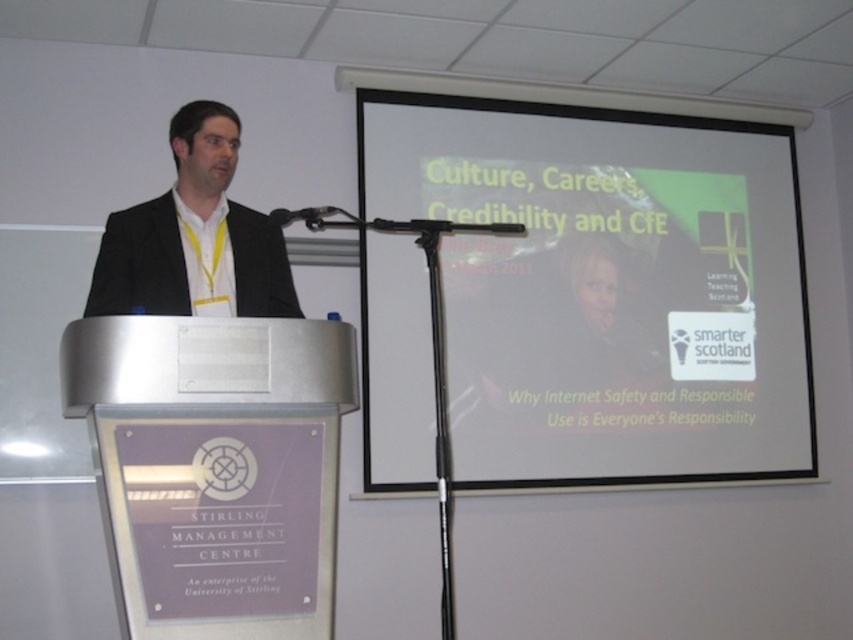
Is white matte projection screen at upper right shorter than black metallic microphone at center?

Incorrect, white matte projection screen at upper right's height does not fall short of black metallic microphone at center's.

Does white matte projection screen at upper right appear on the left side of black metallic microphone at center?

No, white matte projection screen at upper right is not to the left of black metallic microphone at center.

Measure the distance between white matte projection screen at upper right and camera.

They are 3.17 meters apart.

At what (x,y) coordinates should I click in order to perform the action: click on white matte projection screen at upper right. Please return your answer as a coordinate pair (x, y). This screenshot has height=640, width=853. Looking at the image, I should click on (606, 289).

Is point (508, 449) positioned behind point (107, 307)?

That is True.

Who is shorter, white matte projection screen at upper right or black suit at left?

black suit at left is shorter.

This screenshot has width=853, height=640. What do you see at coordinates (606, 289) in the screenshot?
I see `white matte projection screen at upper right` at bounding box center [606, 289].

The height and width of the screenshot is (640, 853). What are the coordinates of `white matte projection screen at upper right` in the screenshot? It's located at (606, 289).

Is black suit at left to the left of black metallic microphone at center from the viewer's perspective?

Correct, you'll find black suit at left to the left of black metallic microphone at center.

Can you confirm if black suit at left is smaller than black metallic microphone at center?

No.

Which is in front, point (129, 256) or point (316, 209)?

Point (129, 256)

What are the coordinates of `black suit at left` in the screenshot? It's located at (194, 236).